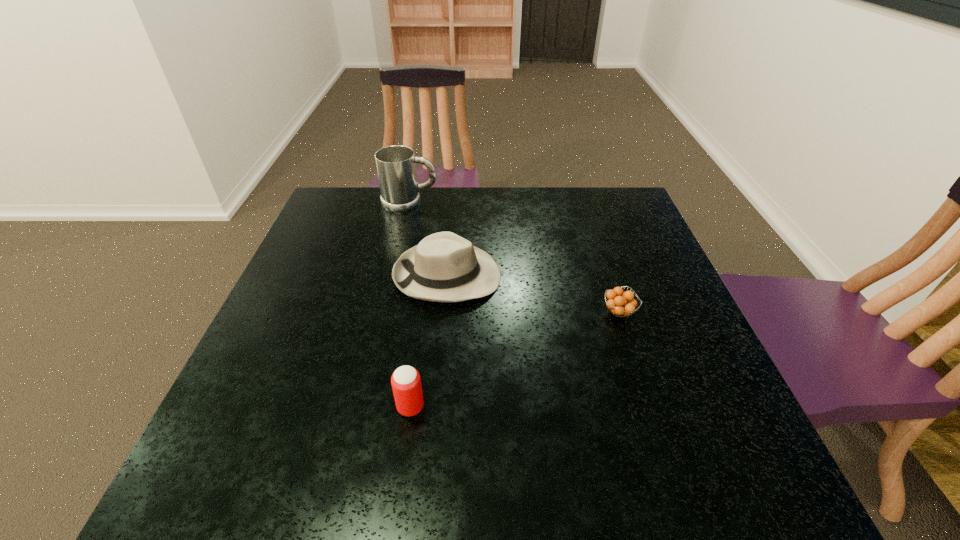
I want to click on free space that satisfies the following two spatial constraints: 1. on the back side of the orange fruit; 2. on the side of the tallest object with the handle, so click(584, 204).

This screenshot has height=540, width=960. In order to click on free space that satisfies the following two spatial constraints: 1. on the back side of the rightmost object; 2. on the front-facing side of the fedora in this screenshot , I will do `click(607, 276)`.

At what (x,y) coordinates should I click in order to perform the action: click on vacant space that satisfies the following two spatial constraints: 1. on the side of the tallest object with the handle; 2. on the left side of the orange fruit. Please return your answer as a coordinate pair (x, y). This screenshot has height=540, width=960. Looking at the image, I should click on (385, 312).

Locate an element on the screen. The image size is (960, 540). free location that satisfies the following two spatial constraints: 1. on the front-facing side of the shortest object; 2. on the right side of the fedora is located at coordinates (444, 312).

At what (x,y) coordinates should I click in order to perform the action: click on vacant region that satisfies the following two spatial constraints: 1. on the back side of the nearest object; 2. on the side of the tallest object with the handle. Please return your answer as a coordinate pair (x, y). Looking at the image, I should click on (438, 204).

The width and height of the screenshot is (960, 540). I want to click on free point that satisfies the following two spatial constraints: 1. on the front-facing side of the fedora; 2. on the right side of the orange fruit, so click(444, 312).

Where is `free space that satisfies the following two spatial constraints: 1. on the side of the shortest object with the handle; 2. on the left side of the tallest object`? Image resolution: width=960 pixels, height=540 pixels. free space that satisfies the following two spatial constraints: 1. on the side of the shortest object with the handle; 2. on the left side of the tallest object is located at coordinates (385, 312).